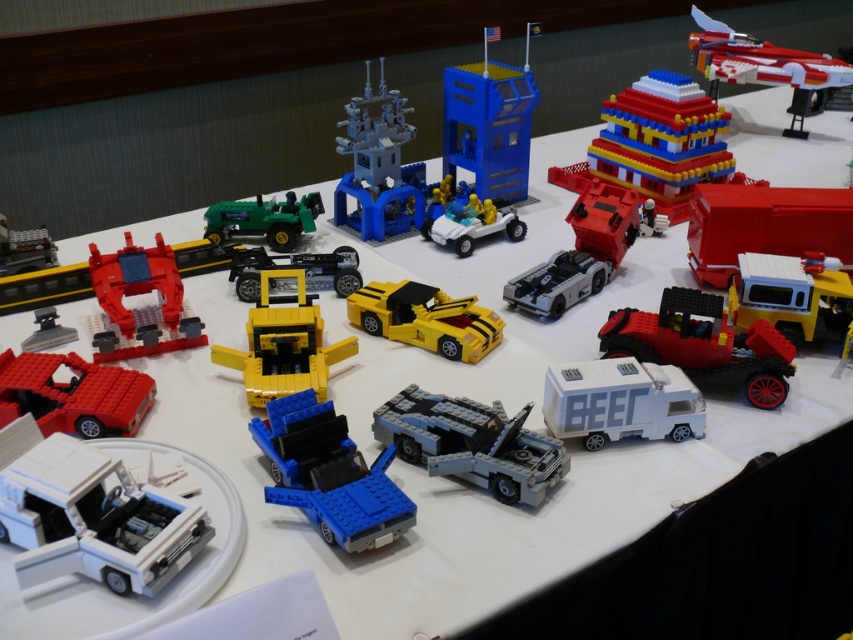
What are the coordinates of the matte blue tower at center?

The coordinates of the matte blue tower at center are (378, 166).